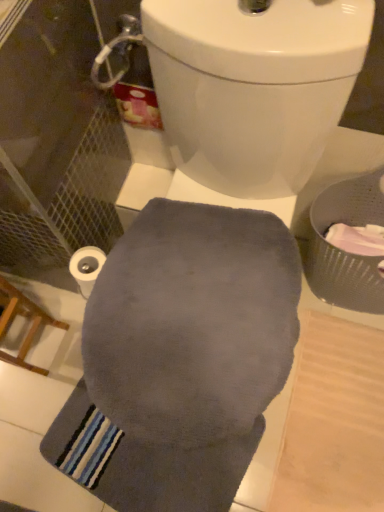
Where is `gray soft towel at center`? gray soft towel at center is located at coordinates (144, 463).

You are a GUI agent. You are given a task and a screenshot of the screen. Output one action in this format:
    pyautogui.click(x=<x>, y=<y>)
    Task: Click on the wooden chair at lower left
    The height and width of the screenshot is (512, 384).
    Given the screenshot: What is the action you would take?
    pyautogui.click(x=26, y=317)

What do you see at coordinates (26, 317) in the screenshot? The height and width of the screenshot is (512, 384). I see `wooden chair at lower left` at bounding box center [26, 317].

The image size is (384, 512). Identify the location of gray soft towel at center. (144, 463).

Is gray soft towel at center not within wooden chair at lower left?

gray soft towel at center lies outside wooden chair at lower left's area.

Is gray soft towel at center facing away from wooden chair at lower left?

No, wooden chair at lower left is not at the back of gray soft towel at center.

Which object is further away from the camera taking this photo, gray soft towel at center or wooden chair at lower left?

gray soft towel at center is further from the camera.

Looking at this image, is the depth of wooden chair at lower left greater than that of gray woven basket at right?

No, wooden chair at lower left is closer to the viewer.

Does wooden chair at lower left appear on the left side of gray woven basket at right?

Indeed, wooden chair at lower left is positioned on the left side of gray woven basket at right.

Between wooden chair at lower left and gray woven basket at right, which one has more height?

wooden chair at lower left is taller.

From the image's perspective, which one is positioned higher, wooden chair at lower left or gray woven basket at right?

gray woven basket at right.

Consider the image. From a real-world perspective, between gray soft towel at center and gray woven basket at right, who is vertically lower?

In real-world perspective, gray soft towel at center is lower.

Based on their positions, is gray soft towel at center located to the left or right of gray woven basket at right?

gray soft towel at center is to the left of gray woven basket at right.

Is gray soft towel at center turned away from gray woven basket at right?

That's not correct — gray soft towel at center is not looking away from gray woven basket at right.

Between point (73, 267) and point (102, 499), which one is positioned behind?

The point (102, 499) is behind.

Does white matte toilet paper at lower left appear on the left side of gray soft towel at center?

Correct, you'll find white matte toilet paper at lower left to the left of gray soft towel at center.

Which object is closer to the camera, white matte toilet paper at lower left or gray soft towel at center?

Positioned in front is white matte toilet paper at lower left.

Is white matte toilet paper at lower left positioned beyond the bounds of gray soft towel at center?

Yes, white matte toilet paper at lower left is not within gray soft towel at center.

Looking at this image, in terms of size, does gray woven basket at right appear bigger or smaller than white matte toilet paper at lower left?

gray woven basket at right is bigger than white matte toilet paper at lower left.

Measure the distance between gray woven basket at right and white matte toilet paper at lower left.

23.19 inches.

Does gray woven basket at right appear on the left side of white matte toilet paper at lower left?

Incorrect, gray woven basket at right is not on the left side of white matte toilet paper at lower left.

Can you confirm if gray woven basket at right is thinner than white matte toilet paper at lower left?

No, gray woven basket at right is not thinner than white matte toilet paper at lower left.

Does wooden chair at lower left have a smaller size compared to gray soft towel at center?

No.

Which point is more forward, (36, 320) or (234, 444)?

Positioned in front is point (234, 444).

Which object is positioned more to the left, wooden chair at lower left or gray soft towel at center?

wooden chair at lower left.

In the scene shown: Is gray soft towel at center located within wooden chair at lower left?

Definitely not — gray soft towel at center is not inside wooden chair at lower left.

Could white matte toilet paper at lower left be considered to be inside gray soft towel at center?

No.

In terms of size, does gray soft towel at center appear bigger or smaller than white matte toilet paper at lower left?

Considering their sizes, gray soft towel at center takes up more space than white matte toilet paper at lower left.

Considering the positions of objects gray soft towel at center and white matte toilet paper at lower left in the image provided, who is more to the right, gray soft towel at center or white matte toilet paper at lower left?

Positioned to the right is gray soft towel at center.

In terms of height, does gray soft towel at center look taller or shorter compared to white matte toilet paper at lower left?

In the image, gray soft towel at center appears to be shorter than white matte toilet paper at lower left.

Identify the location of bath towel below the wooden chair at lower left (from the image's perspective). [144, 463].

Where is `basket above the wooden chair at lower left (from the image's perspective)`? The image size is (384, 512). basket above the wooden chair at lower left (from the image's perspective) is located at coordinates (344, 251).

When comparing their distances from wooden chair at lower left, does gray soft towel at center or white matte toilet paper at lower left seem further?

Among the two, gray soft towel at center is located further to wooden chair at lower left.

From the image, which object appears to be nearer to gray soft towel at center, gray woven basket at right or wooden chair at lower left?

Among the two, wooden chair at lower left is located nearer to gray soft towel at center.

Based on their spatial positions, is wooden chair at lower left or gray woven basket at right further from gray soft towel at center?

gray woven basket at right lies further to gray soft towel at center than the other object.

From the image, which object appears to be nearer to gray woven basket at right, white matte toilet paper at lower left or gray soft towel at center?

Based on the image, gray soft towel at center appears to be nearer to gray woven basket at right.

Which object lies nearer to the anchor point wooden chair at lower left, white matte toilet paper at lower left or gray woven basket at right?

white matte toilet paper at lower left lies closer to wooden chair at lower left than the other object.

In the scene shown: Based on their spatial positions, is white matte toilet paper at lower left or wooden chair at lower left closer to gray woven basket at right?

Based on the image, white matte toilet paper at lower left appears to be nearer to gray woven basket at right.

Looking at the image, which one is located closer to white matte toilet paper at lower left, wooden chair at lower left or gray soft towel at center?

wooden chair at lower left lies closer to white matte toilet paper at lower left than the other object.

Estimate the real-world distances between objects in this image. Which object is closer to gray woven basket at right, wooden chair at lower left or gray soft towel at center?

gray soft towel at center is closer to gray woven basket at right.

The width and height of the screenshot is (384, 512). What are the coordinates of `chair that lies between white matte toilet paper at lower left and gray soft towel at center from top to bottom` in the screenshot? It's located at (26, 317).

At what (x,y) coordinates should I click in order to perform the action: click on bath towel between wooden chair at lower left and gray woven basket at right in the horizontal direction. Please return your answer as a coordinate pair (x, y). The width and height of the screenshot is (384, 512). Looking at the image, I should click on (144, 463).

The image size is (384, 512). What are the coordinates of `bath towel between white matte toilet paper at lower left and gray woven basket at right from left to right` in the screenshot? It's located at (144, 463).

Image resolution: width=384 pixels, height=512 pixels. In order to click on toilet paper situated between wooden chair at lower left and gray woven basket at right from left to right in this screenshot , I will do `click(86, 267)`.